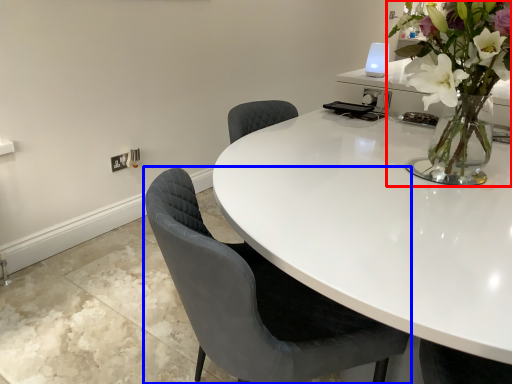
Question: Which point is closer to the camera, houseplant (highlighted by a red box) or chair (highlighted by a blue box)?

Choices:
 (A) houseplant
 (B) chair

Answer: (B)